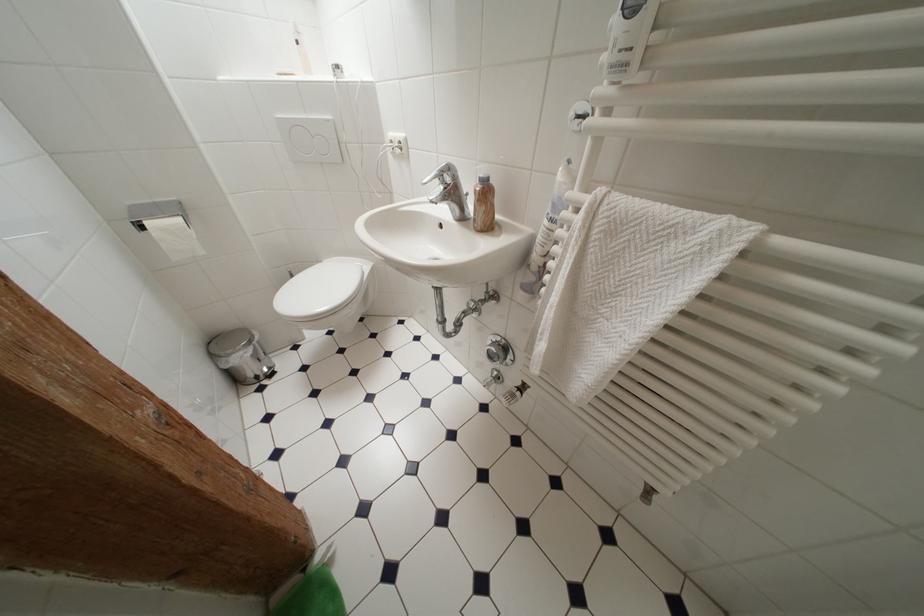
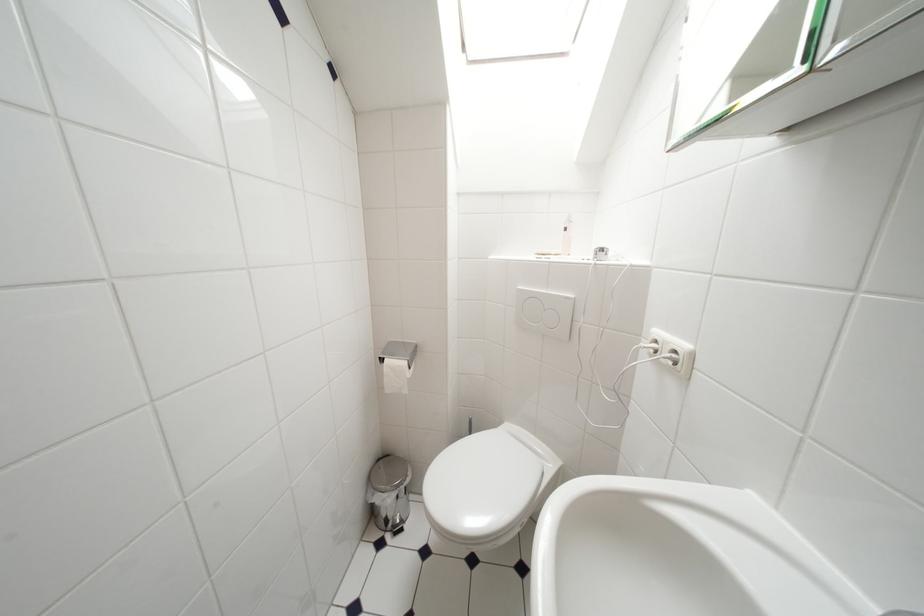
Question: The first image is from the beginning of the video and the second image is from the end. How did the camera likely rotate when shooting the video?

Choices:
 (A) Left
 (B) Right
 (C) Up
 (D) Down

Answer: (A)